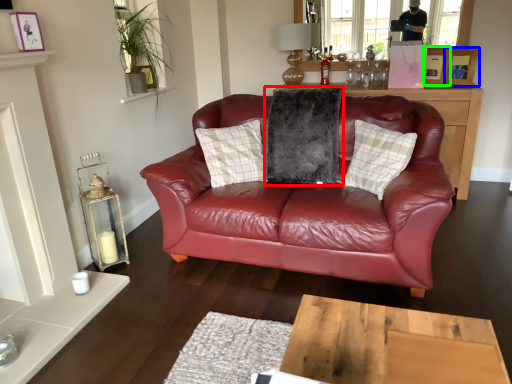
Question: Considering the real-world distances, which object is farthest from pillow (highlighted by a red box)? picture frame (highlighted by a blue box) or picture frame (highlighted by a green box)?

Choices:
 (A) picture frame
 (B) picture frame

Answer: (A)